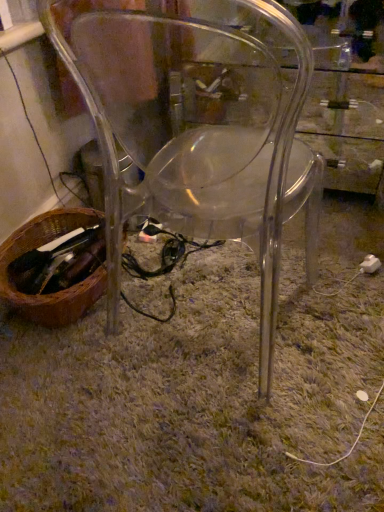
This screenshot has width=384, height=512. In order to click on vacant space that's between brown woven basket at lower left and white plastic plug at lower right in this screenshot , I will do `click(225, 282)`.